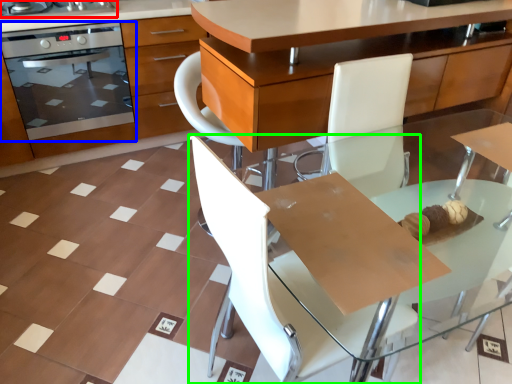
Question: Estimate the real-world distances between objects in this image. Which object is farther from home appliance (highlighted by a red box), kitchen appliance (highlighted by a blue box) or chair (highlighted by a green box)?

Choices:
 (A) kitchen appliance
 (B) chair

Answer: (B)